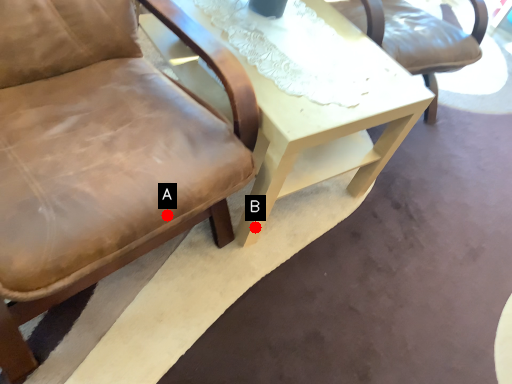
Question: Two points are circled on the image, labeled by A and B beside each circle. Which point appears farthest from the camera in this image?

Choices:
 (A) A is further
 (B) B is further

Answer: (B)